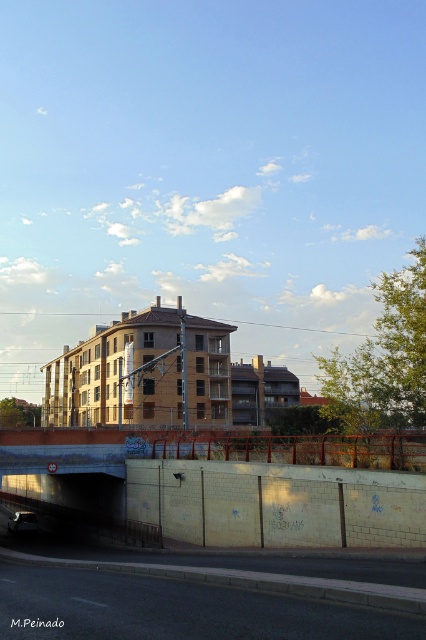
Is black asphalt highway at lower left thinner than shiny silver car at lower left?

Incorrect, black asphalt highway at lower left's width is not less than shiny silver car at lower left's.

Find the location of a particular element. The height and width of the screenshot is (640, 426). black asphalt highway at lower left is located at coordinates (178, 608).

In order to click on black asphalt highway at lower left in this screenshot , I will do coord(178,608).